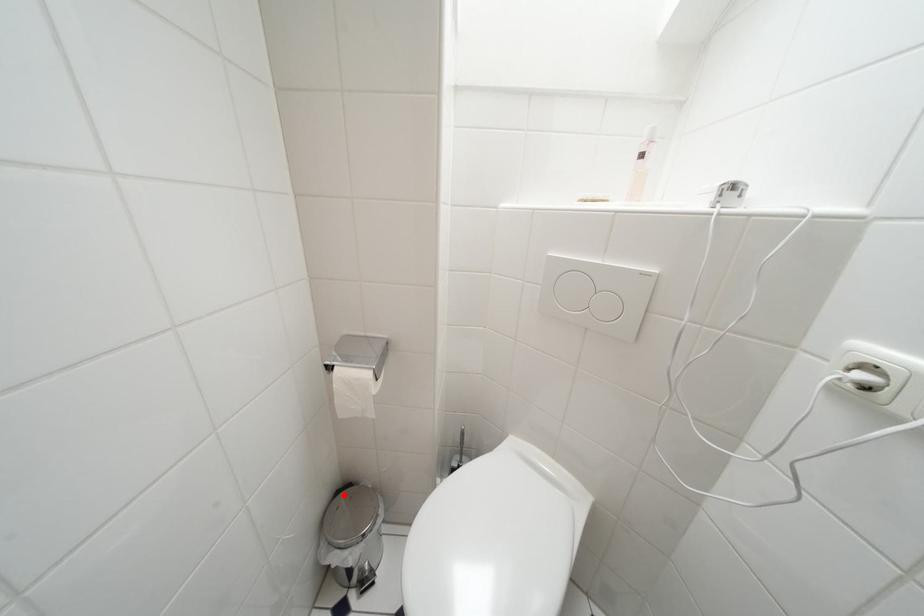
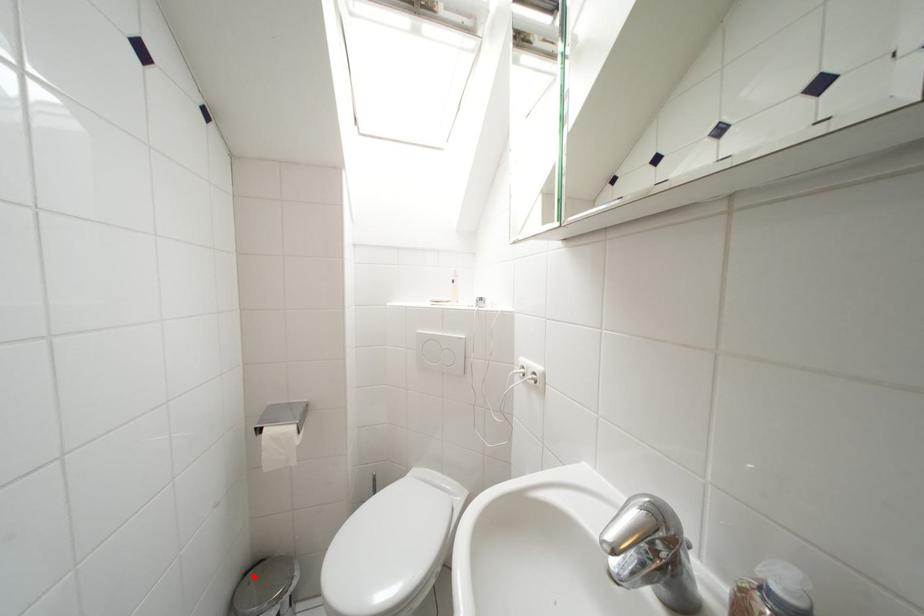
I am providing you with two images of the same scene from different viewpoints. A red point is marked on the first image and another point is marked on the second image. Are the points marked in image1 and image2 representing the same 3D position?

Yes